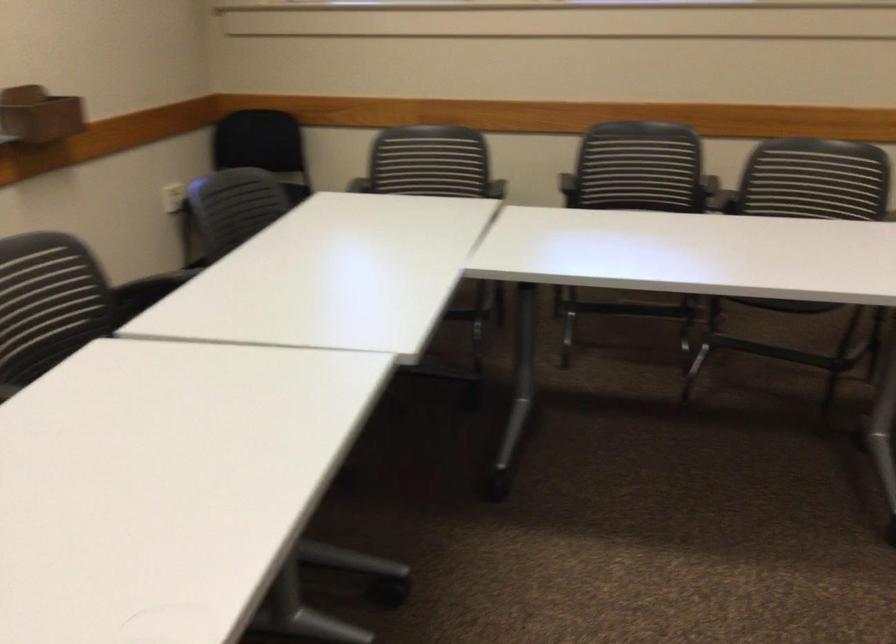
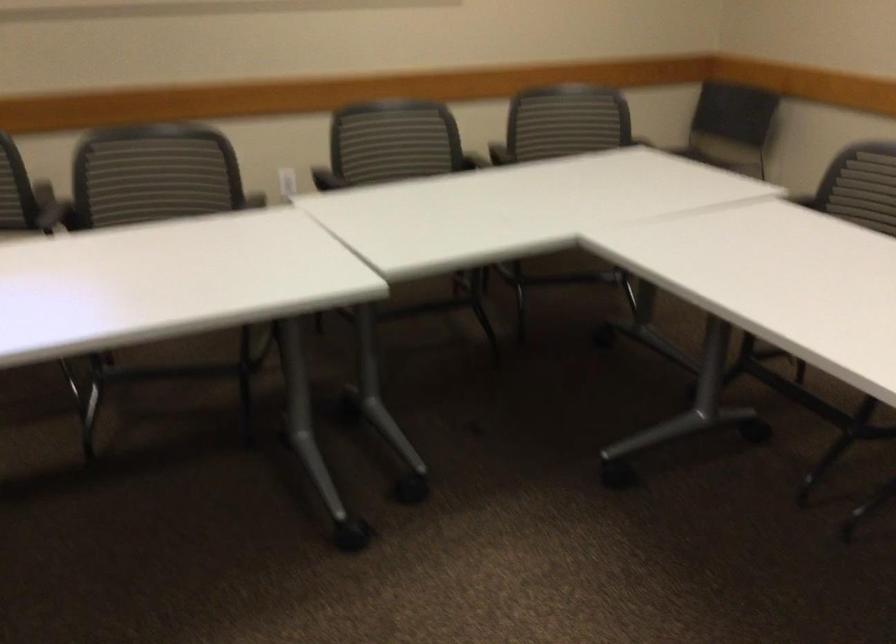
Question: How did the camera likely rotate?

Choices:
 (A) Left
 (B) Right
 (C) Up
 (D) Down

Answer: (B)